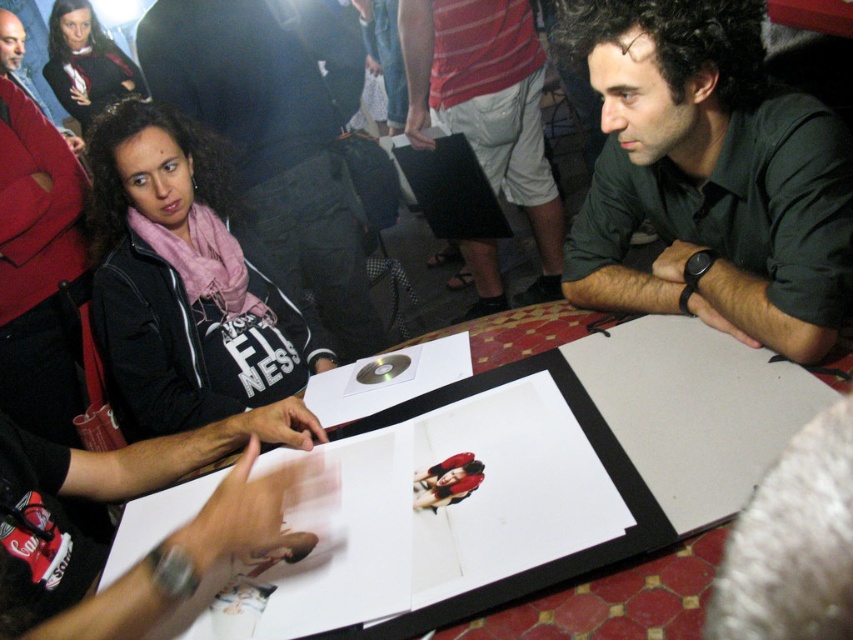
Between smooth wooden table at center and matte black scarf at upper left, which one has less height?

smooth wooden table at center

Does point (740, 474) come closer to viewer compared to point (80, 104)?

Yes, it is in front of point (80, 104).

Is point (585, 488) positioned behind point (80, 81)?

No, it is in front of (80, 81).

Locate an element on the screen. Image resolution: width=853 pixels, height=640 pixels. smooth wooden table at center is located at coordinates [x=546, y=476].

Can you confirm if pink scarf at left is positioned to the right of matte black scarf at upper left?

Yes, pink scarf at left is to the right of matte black scarf at upper left.

Does point (282, 396) come in front of point (90, 68)?

Yes, point (282, 396) is in front of point (90, 68).

This screenshot has width=853, height=640. In order to click on pink scarf at left in this screenshot , I will do `click(181, 282)`.

Does matte black jacket at upper left have a smaller size compared to white cotton shorts at center?

No, matte black jacket at upper left is not smaller than white cotton shorts at center.

Is matte black jacket at upper left shorter than white cotton shorts at center?

In fact, matte black jacket at upper left may be taller than white cotton shorts at center.

Does point (321, 228) come farther from viewer compared to point (531, 188)?

That is False.

Find the location of a particular element. This screenshot has height=640, width=853. matte black jacket at upper left is located at coordinates (276, 138).